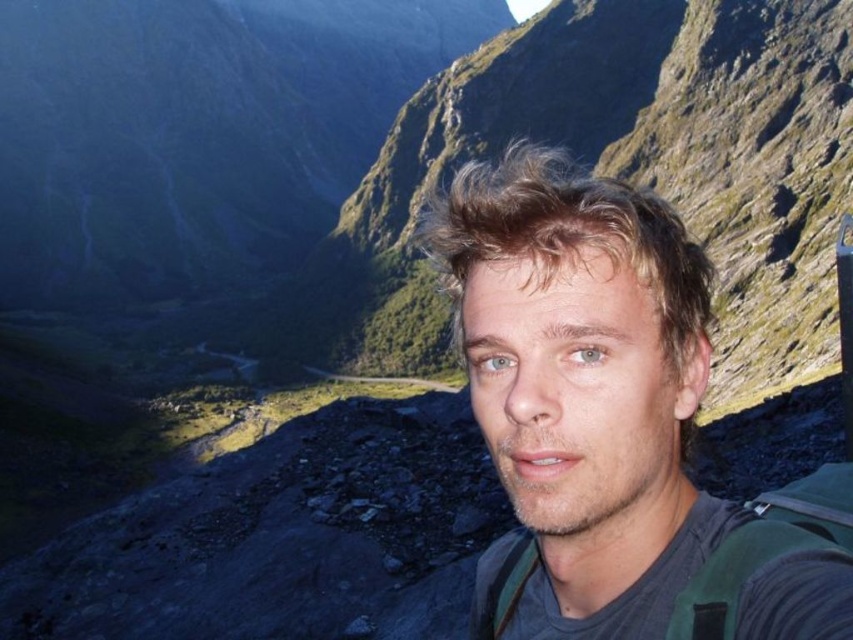
Does blonde hair at center appear on the right side of green fabric strap at lower right?

Correct, you'll find blonde hair at center to the right of green fabric strap at lower right.

Which is below, blonde hair at center or green fabric strap at lower right?

green fabric strap at lower right

Does point (695, 326) lie behind point (489, 596)?

No, (695, 326) is in front of (489, 596).

The height and width of the screenshot is (640, 853). What are the coordinates of `blonde hair at center` in the screenshot? It's located at (618, 419).

Does blonde hair at center have a lesser width compared to green fabric backpack at center?

In fact, blonde hair at center might be wider than green fabric backpack at center.

I want to click on blonde hair at center, so click(x=618, y=419).

In the scene shown: Does green fabric backpack at center have a lesser width compared to green fabric strap at lower right?

Yes.

Between point (795, 515) and point (491, 595), which one is positioned in front?

Positioned in front is point (795, 515).

This screenshot has width=853, height=640. Describe the element at coordinates (764, 547) in the screenshot. I see `green fabric backpack at center` at that location.

At what (x,y) coordinates should I click in order to perform the action: click on green fabric backpack at center. Please return your answer as a coordinate pair (x, y). The width and height of the screenshot is (853, 640). Looking at the image, I should click on (764, 547).